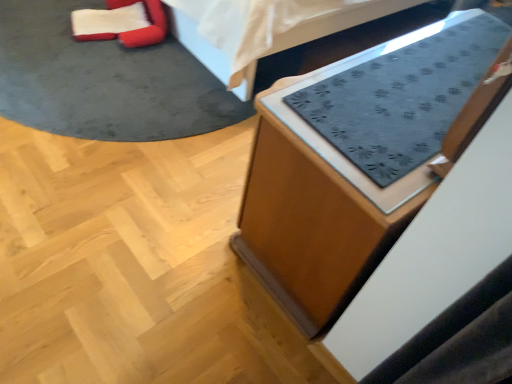
Question: Can you confirm if velvet red bean bag chair at upper left is smaller than wooden cabinet at lower right, which ranks as the 1th furniture in bottom-to-top order?

Choices:
 (A) yes
 (B) no

Answer: (A)

Question: Is velvet red bean bag chair at upper left next to wooden cabinet at lower right, which is the second furniture from top to bottom?

Choices:
 (A) yes
 (B) no

Answer: (B)

Question: Considering the relative sizes of velvet red bean bag chair at upper left and wooden cabinet at lower right, which ranks as the 1th furniture in bottom-to-top order, in the image provided, is velvet red bean bag chair at upper left shorter than wooden cabinet at lower right, which ranks as the 1th furniture in bottom-to-top order,?

Choices:
 (A) yes
 (B) no

Answer: (A)

Question: Does velvet red bean bag chair at upper left have a greater height compared to wooden cabinet at lower right, which is the second furniture from top to bottom?

Choices:
 (A) yes
 (B) no

Answer: (B)

Question: Can you confirm if velvet red bean bag chair at upper left is positioned to the left of wooden cabinet at lower right, which ranks as the 1th furniture in bottom-to-top order?

Choices:
 (A) no
 (B) yes

Answer: (B)

Question: Is the depth of velvet red bean bag chair at upper left less than that of wooden cabinet at lower right, which ranks as the 1th furniture in bottom-to-top order?

Choices:
 (A) yes
 (B) no

Answer: (B)

Question: Does dark gray fabric mat at upper center, which appears as the second furniture when ordered from the bottom, come in front of velvet red bean bag chair at upper left?

Choices:
 (A) yes
 (B) no

Answer: (A)

Question: Is dark gray fabric mat at upper center, the first furniture positioned from the top, located outside velvet red bean bag chair at upper left?

Choices:
 (A) no
 (B) yes

Answer: (B)

Question: From the image's perspective, is dark gray fabric mat at upper center, which appears as the second furniture when ordered from the bottom, on velvet red bean bag chair at upper left?

Choices:
 (A) no
 (B) yes

Answer: (B)

Question: Is dark gray fabric mat at upper center, which appears as the second furniture when ordered from the bottom, shorter than velvet red bean bag chair at upper left?

Choices:
 (A) yes
 (B) no

Answer: (B)

Question: Is dark gray fabric mat at upper center, which appears as the second furniture when ordered from the bottom, aimed at velvet red bean bag chair at upper left?

Choices:
 (A) yes
 (B) no

Answer: (A)

Question: Does dark gray fabric mat at upper center, which appears as the second furniture when ordered from the bottom, have a smaller size compared to velvet red bean bag chair at upper left?

Choices:
 (A) no
 (B) yes

Answer: (A)

Question: Does velvet red bean bag chair at upper left have a larger size compared to dark gray fabric mat at upper center, the first furniture positioned from the top?

Choices:
 (A) yes
 (B) no

Answer: (B)